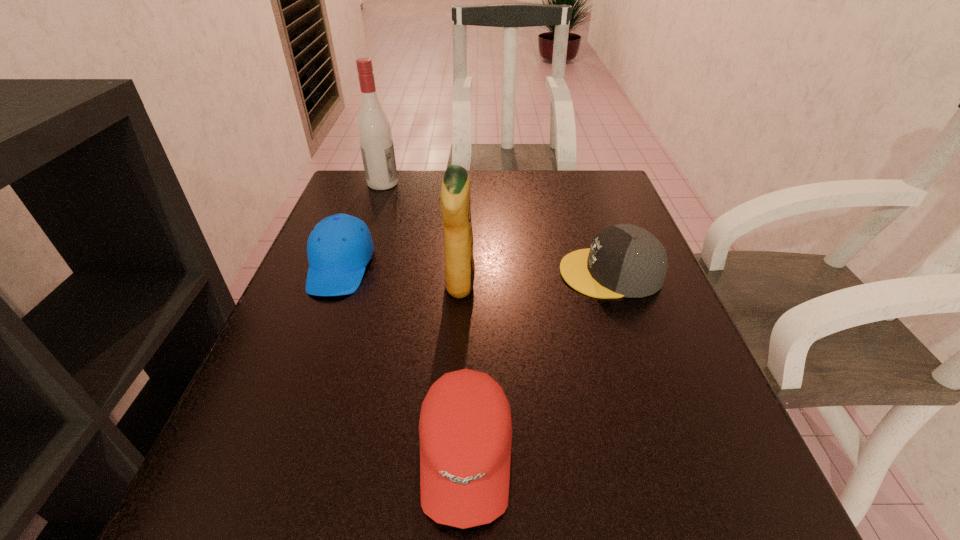
The height and width of the screenshot is (540, 960). Identify the location of vacant space at the near edge. (396, 492).

In the image, there is a desktop. At what (x,y) coordinates should I click in order to perform the action: click on vacant area at the left edge. Please return your answer as a coordinate pair (x, y). The width and height of the screenshot is (960, 540). Looking at the image, I should click on (234, 410).

The image size is (960, 540). What are the coordinates of `vacant region at the right edge of the desktop` in the screenshot? It's located at (674, 455).

Where is `vacant space at the far left corner of the desktop`? This screenshot has height=540, width=960. vacant space at the far left corner of the desktop is located at coordinates (403, 174).

The image size is (960, 540). In the image, there is a desktop. Identify the location of vacant space at the near left corner. (316, 504).

In the image, there is a desktop. What are the coordinates of `free space at the far right corner` in the screenshot? It's located at (606, 176).

Locate an element on the screen. vacant space in between the leftmost cap and the nearest object is located at coordinates (403, 361).

Where is `free area in between the rightmost object and the fourth shortest object`? The width and height of the screenshot is (960, 540). free area in between the rightmost object and the fourth shortest object is located at coordinates (535, 279).

Where is `vacant area between the farthest object and the detergent`? This screenshot has height=540, width=960. vacant area between the farthest object and the detergent is located at coordinates (421, 234).

This screenshot has height=540, width=960. I want to click on vacant point located between the nearest cap and the rightmost object, so click(538, 364).